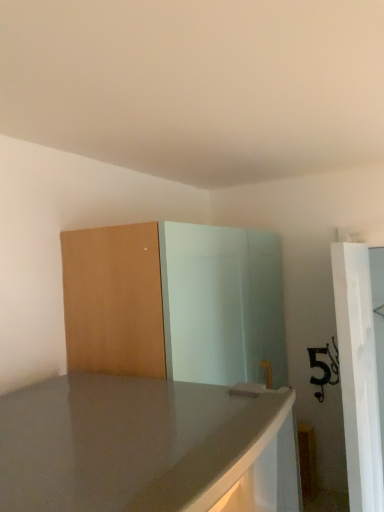
This screenshot has height=512, width=384. Describe the element at coordinates (175, 302) in the screenshot. I see `matte wood dresser at center` at that location.

The height and width of the screenshot is (512, 384). Find the location of `matte wood dresser at center`. matte wood dresser at center is located at coordinates (175, 302).

Locate an element on the screen. This screenshot has height=512, width=384. white glossy screen door at right is located at coordinates (358, 375).

The image size is (384, 512). What do you see at coordinates (358, 375) in the screenshot? I see `white glossy screen door at right` at bounding box center [358, 375].

From the picture: Measure the distance between point (339,298) and camera.

The depth of point (339,298) is 3.71 feet.

The image size is (384, 512). In order to click on matte wood dresser at center in this screenshot , I will do `click(175, 302)`.

Consider the image. Considering the positions of objects matte wood dresser at center and white glossy screen door at right in the image provided, who is more to the left, matte wood dresser at center or white glossy screen door at right?

From the viewer's perspective, matte wood dresser at center appears more on the left side.

Between matte wood dresser at center and white glossy screen door at right, which one is positioned behind?

white glossy screen door at right is behind.

Which is further, (x=157, y=323) or (x=366, y=483)?

The point (x=366, y=483) is more distant.

From the image's perspective, which one is positioned higher, matte wood dresser at center or white glossy screen door at right?

matte wood dresser at center.

From a real-world perspective, which object stands above the other?

In real-world perspective, matte wood dresser at center is above.

Considering the relative sizes of matte wood dresser at center and white glossy screen door at right in the image provided, is matte wood dresser at center thinner than white glossy screen door at right?

No, matte wood dresser at center is not thinner than white glossy screen door at right.

Can you confirm if matte wood dresser at center is taller than white glossy screen door at right?

No.

Between matte wood dresser at center and white glossy screen door at right, which one has smaller size?

white glossy screen door at right.

Is matte wood dresser at center located outside white glossy screen door at right?

matte wood dresser at center is positioned outside white glossy screen door at right.

Can you see matte wood dresser at center touching white glossy screen door at right?

matte wood dresser at center and white glossy screen door at right are clearly separated.

Based on the photo, is matte wood dresser at center oriented towards white glossy screen door at right?

Yes, matte wood dresser at center faces towards white glossy screen door at right.

How many degrees apart are the facing directions of matte wood dresser at center and white glossy screen door at right?

They differ by 0.736 degrees in their facing directions.

Where is `dresser to the left of white glossy screen door at right`? The width and height of the screenshot is (384, 512). dresser to the left of white glossy screen door at right is located at coordinates (175, 302).

Which is more to the left, white glossy screen door at right or matte wood dresser at center?

matte wood dresser at center.

From the picture: Which is in front, white glossy screen door at right or matte wood dresser at center?

matte wood dresser at center is closer to the camera.

Considering the points (375, 476) and (169, 324), which point is behind, point (375, 476) or point (169, 324)?

The point (375, 476) is behind.

From the image's perspective, is white glossy screen door at right above matte wood dresser at center?

No.

From a real-world perspective, does white glossy screen door at right stand above matte wood dresser at center?

No, from a real-world perspective, white glossy screen door at right is not on top of matte wood dresser at center.

Can you confirm if white glossy screen door at right is thinner than matte wood dresser at center?

Correct, the width of white glossy screen door at right is less than that of matte wood dresser at center.

Who is taller, white glossy screen door at right or matte wood dresser at center?

Standing taller between the two is white glossy screen door at right.

Between white glossy screen door at right and matte wood dresser at center, which one has larger size?

Bigger between the two is matte wood dresser at center.

Is white glossy screen door at right completely or partially outside of matte wood dresser at center?

Absolutely, white glossy screen door at right is external to matte wood dresser at center.

From the picture: Are white glossy screen door at right and matte wood dresser at center far apart?

white glossy screen door at right is actually quite close to matte wood dresser at center.

Is matte wood dresser at center at the back of white glossy screen door at right?

Absolutely, white glossy screen door at right is directed away from matte wood dresser at center.

How different are the orientations of white glossy screen door at right and matte wood dresser at center in degrees?

There is a 0.736-degree angle between the facing directions of white glossy screen door at right and matte wood dresser at center.

How far apart are white glossy screen door at right and matte wood dresser at center?

white glossy screen door at right is 17.34 inches away from matte wood dresser at center.

In order to click on screen door on the right of matte wood dresser at center in this screenshot , I will do `click(358, 375)`.

The height and width of the screenshot is (512, 384). I want to click on dresser that appears on the left of white glossy screen door at right, so click(175, 302).

Locate an element on the screen. The height and width of the screenshot is (512, 384). screen door that appears on the right of matte wood dresser at center is located at coordinates (358, 375).